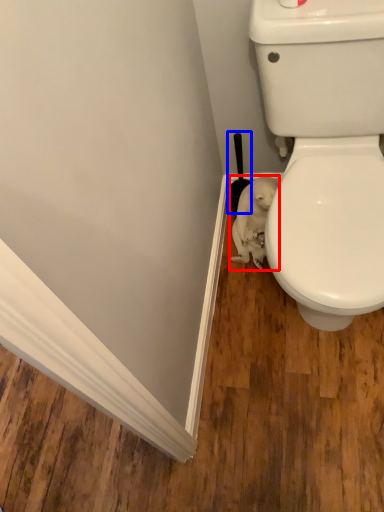
Question: Which object appears farthest to the camera in this image, animal (highlighted by a red box) or brush (highlighted by a blue box)?

Choices:
 (A) animal
 (B) brush

Answer: (B)